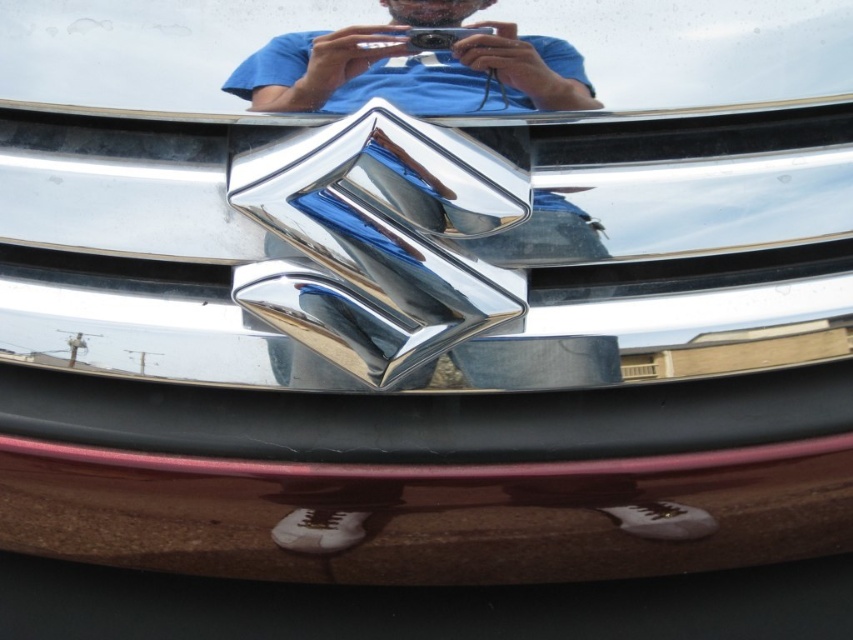
You are standing in front of the car and want to take a photo of the chrome metallic logo at center without including the glossy black bumper at lower center in the frame. Is this possible based on their positions?

The glossy black bumper at lower center is to the left of the chrome metallic logo at center. Since the bumper is positioned to the left of the logo, you can adjust your camera angle to the right side of the bumper to capture the logo without including the bumper in the frame.

You are a mechanic working on a car and need to attach a new bumper. The bumper you have is 8 inches long. The chrome metallic logo at center is already installed. Can the glossy black bumper at lower center with the new bumper fit without overlapping the logo?

The distance between the glossy black bumper at lower center and the chrome metallic logo at center is 8.32 inches. Since the new bumper is 8 inches long, there will be a 0.32 inch gap between them, so it can fit without overlapping.

You are a photographer trying to capture the chrome metallic logo at center and the glossy black bumper at lower center in a single frame. Based on their sizes, which object will appear bigger in your photo?

The glossy black bumper at lower center will appear bigger in the photo since it has a larger size compared to the chrome metallic logo at center.